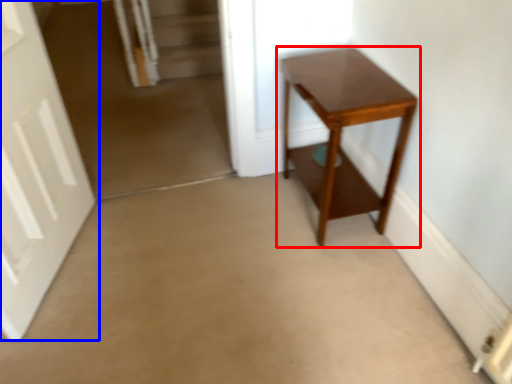
Question: Which point is closer to the camera, table (highlighted by a red box) or door (highlighted by a blue box)?

Choices:
 (A) table
 (B) door

Answer: (B)